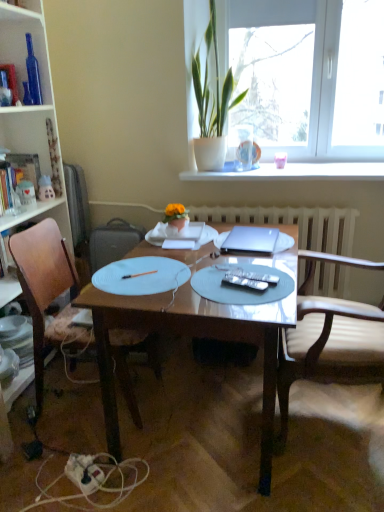
At what (x,y) coordinates should I click in order to perform the action: click on vacant region to the right of white paper notebook at center. Please return your answer as a coordinate pair (x, y). The image size is (384, 512). Looking at the image, I should click on tap(220, 252).